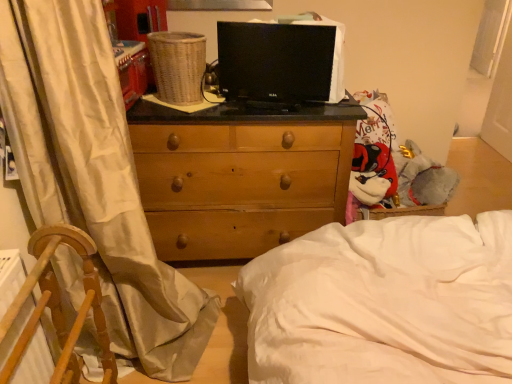
Question: Considering the relative sizes of white fabric screen door at right and woven brown basket at upper center in the image provided, is white fabric screen door at right taller than woven brown basket at upper center?

Choices:
 (A) no
 (B) yes

Answer: (B)

Question: Is the depth of white fabric screen door at right greater than that of woven brown basket at upper center?

Choices:
 (A) yes
 (B) no

Answer: (A)

Question: Is white fabric screen door at right outside of woven brown basket at upper center?

Choices:
 (A) yes
 (B) no

Answer: (A)

Question: Considering the relative sizes of white fabric screen door at right and woven brown basket at upper center in the image provided, is white fabric screen door at right smaller than woven brown basket at upper center?

Choices:
 (A) no
 (B) yes

Answer: (A)

Question: Is white fabric screen door at right facing towards woven brown basket at upper center?

Choices:
 (A) yes
 (B) no

Answer: (B)

Question: From the image's perspective, is white fabric screen door at right below woven brown basket at upper center?

Choices:
 (A) no
 (B) yes

Answer: (A)

Question: Can you confirm if woven brown basket at upper center is thinner than wooden chest of drawers at center?

Choices:
 (A) no
 (B) yes

Answer: (B)

Question: Is woven brown basket at upper center closer to camera compared to wooden chest of drawers at center?

Choices:
 (A) yes
 (B) no

Answer: (A)

Question: Does woven brown basket at upper center turn towards wooden chest of drawers at center?

Choices:
 (A) no
 (B) yes

Answer: (A)

Question: Does woven brown basket at upper center touch wooden chest of drawers at center?

Choices:
 (A) no
 (B) yes

Answer: (A)

Question: Can you confirm if woven brown basket at upper center is taller than wooden chest of drawers at center?

Choices:
 (A) no
 (B) yes

Answer: (A)

Question: Is woven brown basket at upper center to the left of wooden chest of drawers at center from the viewer's perspective?

Choices:
 (A) yes
 (B) no

Answer: (A)

Question: From the image's perspective, is white soft bed at center on white fabric screen door at right?

Choices:
 (A) no
 (B) yes

Answer: (A)